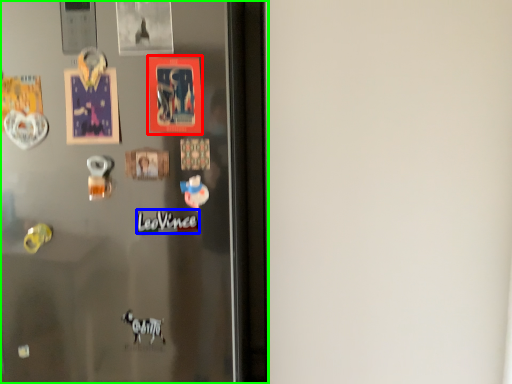
Question: Considering the real-world distances, which object is farthest from postcard (highlighted by a red box)? writing (highlighted by a blue box) or refrigerator (highlighted by a green box)?

Choices:
 (A) writing
 (B) refrigerator

Answer: (B)